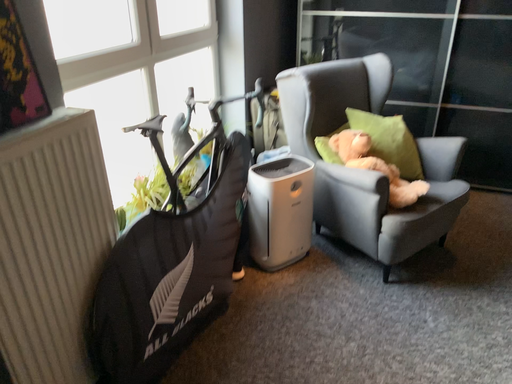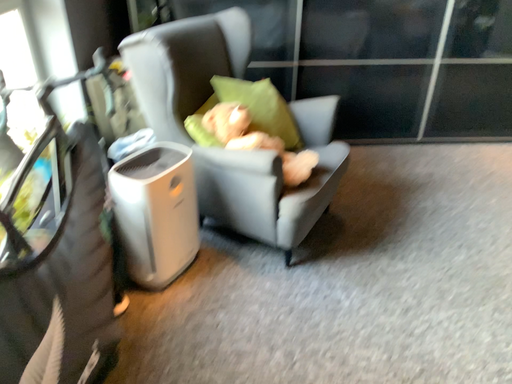
Question: Which way did the camera rotate in the video?

Choices:
 (A) rotated left
 (B) rotated right

Answer: (B)